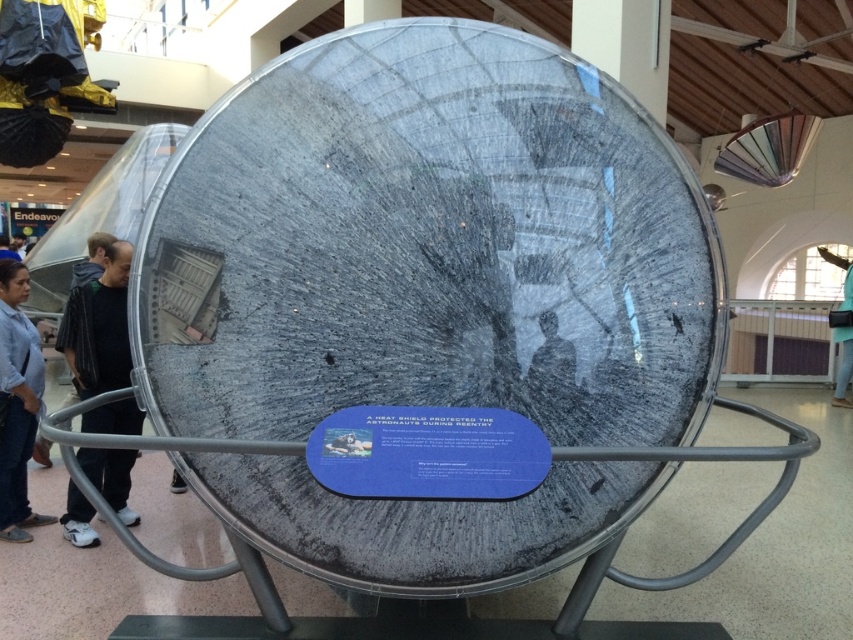
Question: Does dark gray fabric jacket at left have a lesser width compared to denim jeans at lower left?

Choices:
 (A) yes
 (B) no

Answer: (B)

Question: Based on their relative distances, which object is nearer to the denim jeans at lower left?

Choices:
 (A) matte black helmet at center
 (B) dark gray fabric jacket at left

Answer: (B)

Question: Can you confirm if dark gray fabric jacket at left is thinner than denim jeans at lower left?

Choices:
 (A) no
 (B) yes

Answer: (A)

Question: Is denim jeans at lower left above matte black helmet at center?

Choices:
 (A) yes
 (B) no

Answer: (B)

Question: Which object appears farthest from the camera in this image?

Choices:
 (A) dark gray fabric jacket at left
 (B) matte black helmet at center

Answer: (A)

Question: Which point is closer to the camera taking this photo?

Choices:
 (A) (19, 336)
 (B) (85, 305)

Answer: (B)